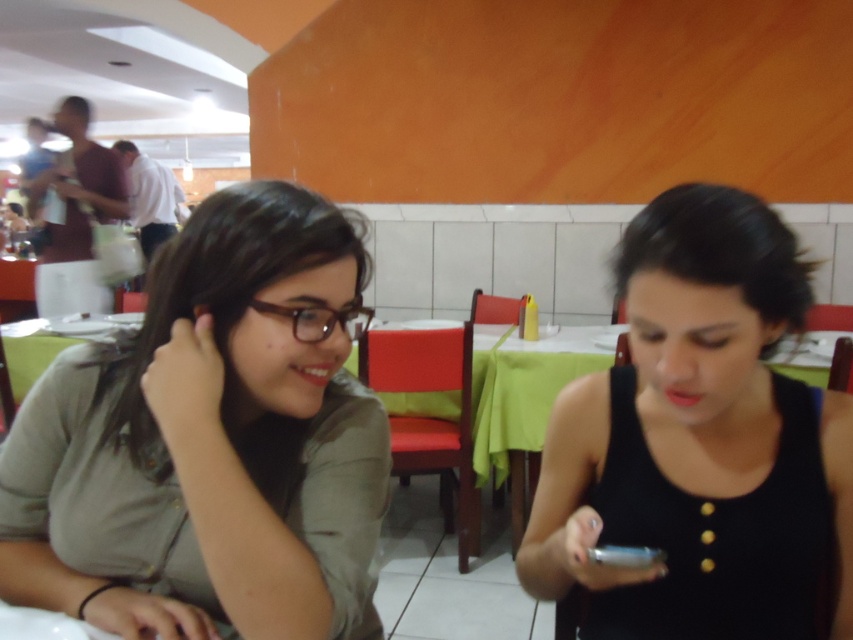
Does matte green shirt at left appear on the left side of black matte tank top at center?

Correct, you'll find matte green shirt at left to the left of black matte tank top at center.

Where is `matte green shirt at left`? This screenshot has height=640, width=853. matte green shirt at left is located at coordinates (210, 442).